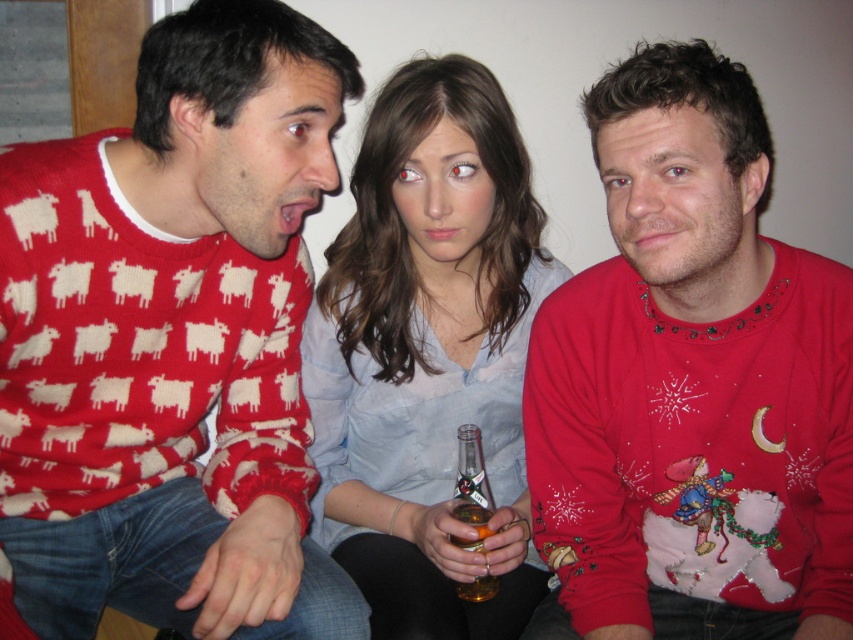
Is matte red sweater at left positioned in front of translucent glass bottle at center?

Yes, it is.

Can you confirm if matte red sweater at left is positioned to the right of translucent glass bottle at center?

In fact, matte red sweater at left is to the left of translucent glass bottle at center.

The height and width of the screenshot is (640, 853). What do you see at coordinates (171, 342) in the screenshot? I see `matte red sweater at left` at bounding box center [171, 342].

Locate an element on the screen. This screenshot has height=640, width=853. matte red sweater at left is located at coordinates (x=171, y=342).

Is shiny red sweater at center below translucent glass bottle at center?

No.

Identify the location of shiny red sweater at center. Image resolution: width=853 pixels, height=640 pixels. (691, 384).

How far apart are matte red sweater at left and shiny red sweater at center?

matte red sweater at left and shiny red sweater at center are 15.87 inches apart from each other.

Is matte red sweater at left positioned behind shiny red sweater at center?

No, matte red sweater at left is in front of shiny red sweater at center.

Who is more distant from viewer, [267,384] or [634,138]?

Positioned behind is point [267,384].

The width and height of the screenshot is (853, 640). I want to click on matte red sweater at left, so click(171, 342).